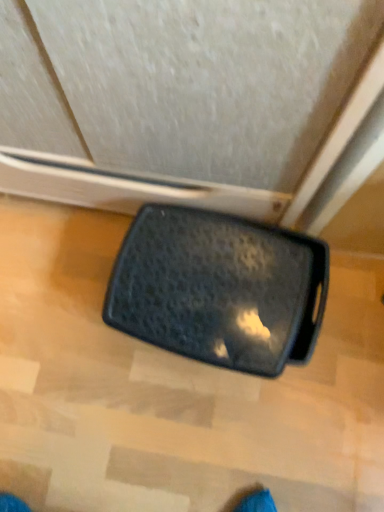
This screenshot has width=384, height=512. I want to click on black rubber mat at center, so click(x=219, y=289).

What do you see at coordinates (219, 289) in the screenshot? This screenshot has height=512, width=384. I see `black rubber mat at center` at bounding box center [219, 289].

Where is `black rubber mat at center`? The width and height of the screenshot is (384, 512). black rubber mat at center is located at coordinates (219, 289).